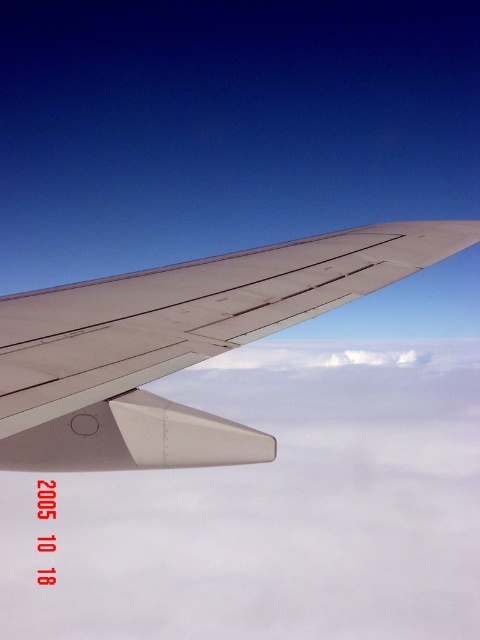
Question: Which point is closer to the camera?

Choices:
 (A) metallic gray wing at upper center
 (B) white fluffy cloud at center

Answer: (A)

Question: Which object is closer to the camera taking this photo?

Choices:
 (A) metallic gray wing at upper center
 (B) white fluffy cloud at center

Answer: (A)

Question: Can you confirm if white fluffy cloud at center is bigger than metallic gray wing at upper center?

Choices:
 (A) yes
 (B) no

Answer: (A)

Question: Does white fluffy cloud at center appear under metallic gray wing at upper center?

Choices:
 (A) yes
 (B) no

Answer: (A)

Question: Does white fluffy cloud at center appear under metallic gray wing at upper center?

Choices:
 (A) no
 (B) yes

Answer: (B)